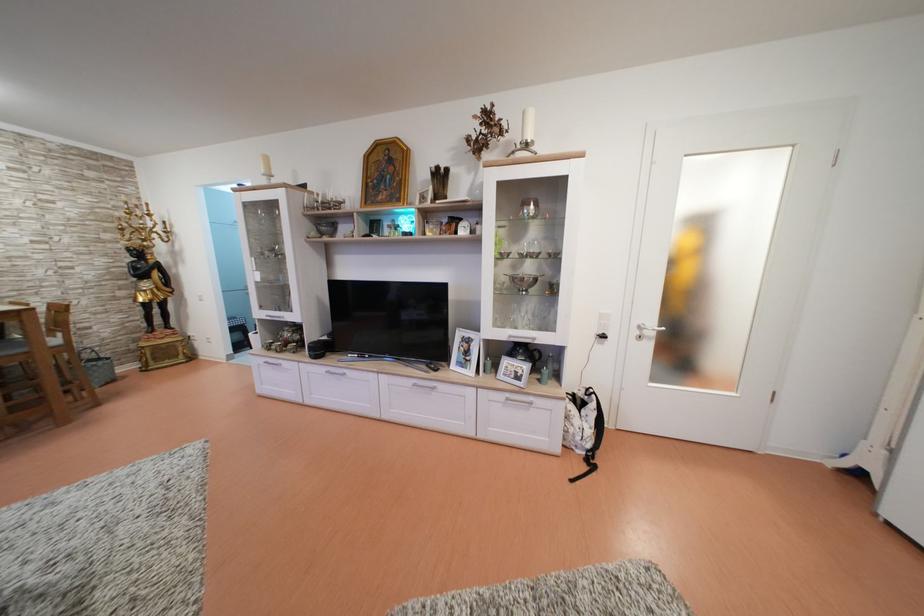
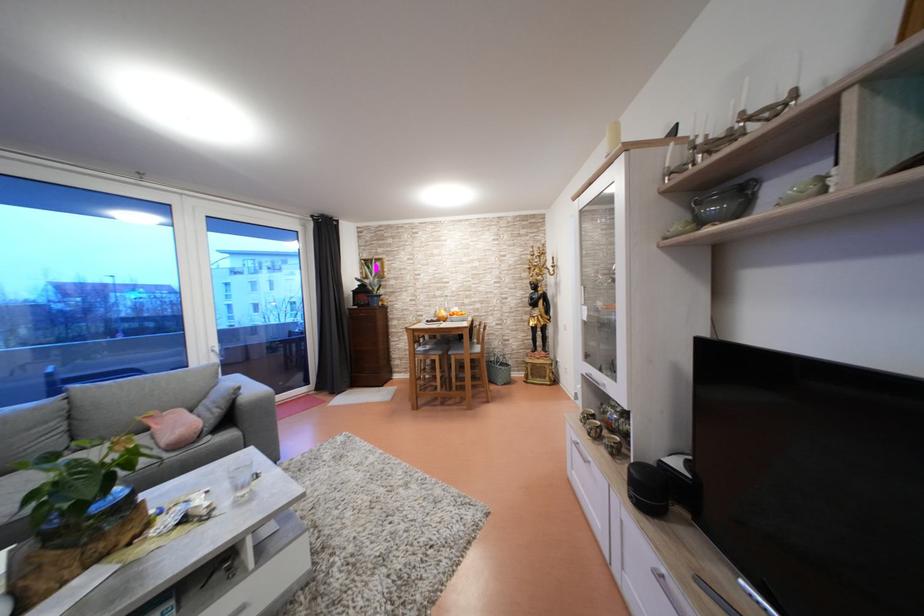
The point at (327, 355) is marked in the first image. Where is the corresponding point in the second image?

(662, 500)